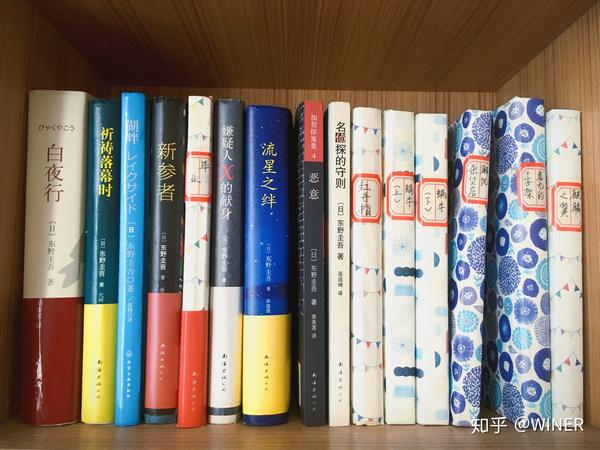
The height and width of the screenshot is (450, 600). I want to click on five right-most books, so click(567, 166), click(521, 168), click(474, 164), click(430, 167), click(402, 167).